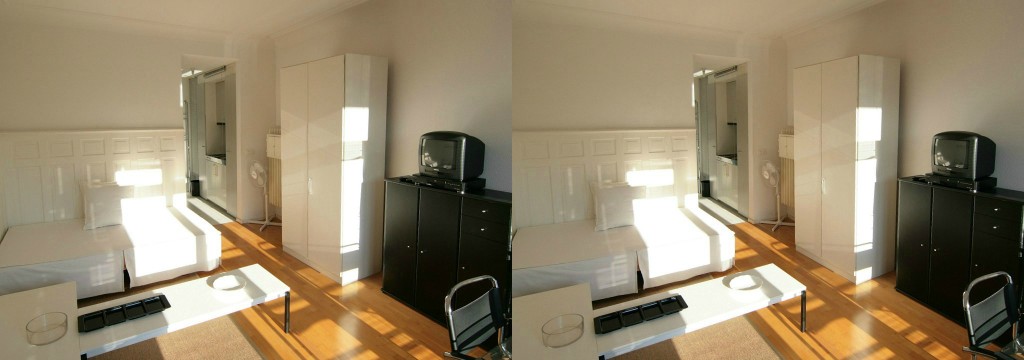
At what (x,y) coordinates should I click in order to perform the action: click on wall. Please return your answer as a coordinate pair (x, y). Image resolution: width=1024 pixels, height=360 pixels. Looking at the image, I should click on (972, 67), (429, 73).